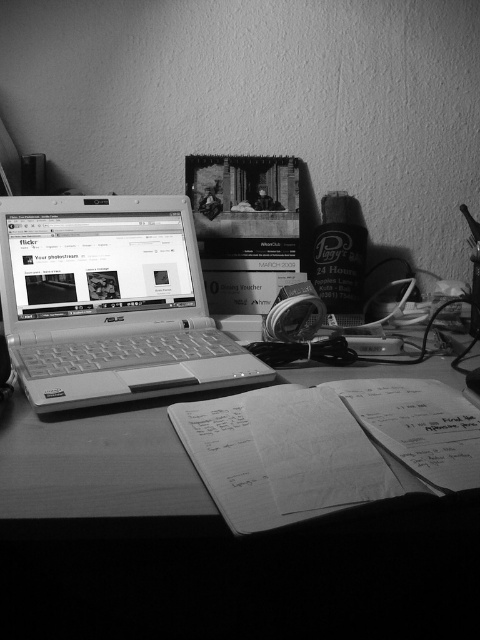
You are organizing a small event and need to place a 1.2 meter long banner on the desk. Given the metallic silver laptop at left and the wooden table at center, can the banner fit on the table without overlapping the laptop?

The metallic silver laptop at left is larger in size than the wooden table at center. Since the laptop is larger than the table, the banner which is 1.2 meters long may not fit without overlapping because the table might be too small.

You are organizing a workspace and need to place a new item between the metallic silver laptop at left and the wooden table at center. Is there enough space to fit something in between them?

The metallic silver laptop at left is to the left of the wooden table at center, so there is space between them to place a new item.